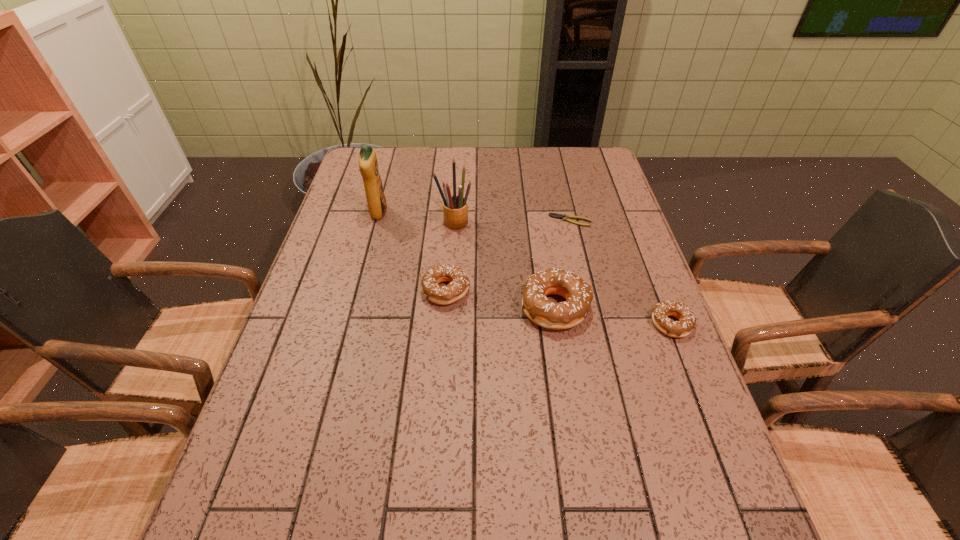
Please show where to add a doughnut on the left while keeping spacing even. Please provide its 2D coordinates. Your answer should be formatted as a tuple, i.e. [(x, y)], where the tuple contains the x and y coordinates of a point satisfying the conditions above.

[(345, 276)]